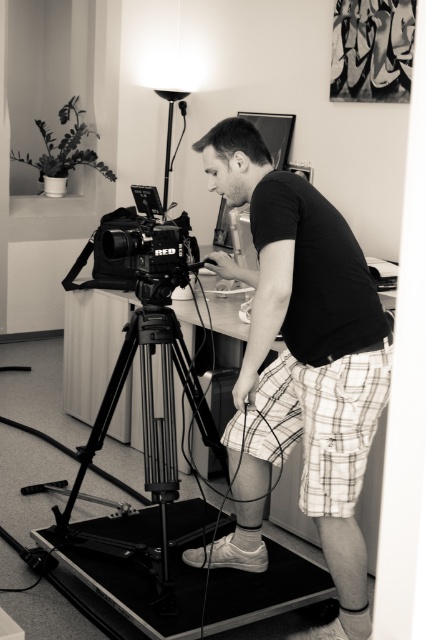
Is black cotton t-shirt at center closer to the viewer compared to matte black camera at left?

Yes, black cotton t-shirt at center is closer to the viewer.

Find the location of a particular element. black cotton t-shirt at center is located at coordinates (301, 362).

Locate an element on the screen. The height and width of the screenshot is (640, 426). black cotton t-shirt at center is located at coordinates (301, 362).

Does black cotton t-shirt at center appear on the right side of white plaid shorts at center?

Incorrect, black cotton t-shirt at center is not on the right side of white plaid shorts at center.

Is point (259, 314) in front of point (262, 451)?

Yes, point (259, 314) is in front of point (262, 451).

This screenshot has height=640, width=426. What do you see at coordinates (301, 362) in the screenshot?
I see `black cotton t-shirt at center` at bounding box center [301, 362].

You are a GUI agent. You are given a task and a screenshot of the screen. Output one action in this format:
    pyautogui.click(x=<x>, y=<y>)
    Task: Click on the black cotton t-shirt at center
    The width and height of the screenshot is (426, 640).
    Given the screenshot: What is the action you would take?
    pyautogui.click(x=301, y=362)

Can you confirm if black metal tripod at center is positioned below matte black camera at left?

Indeed, black metal tripod at center is positioned under matte black camera at left.

Can you confirm if black metal tripod at center is positioned to the right of matte black camera at left?

Yes, black metal tripod at center is to the right of matte black camera at left.

Which is in front, point (135, 323) or point (183, 266)?

Point (183, 266) is more forward.

The image size is (426, 640). Identify the location of black metal tripod at center. pyautogui.click(x=147, y=435).